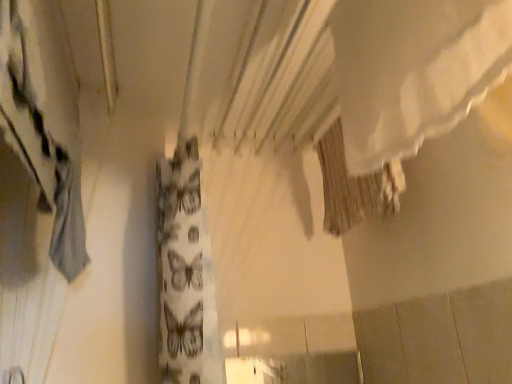
Question: Is gray fabric curtain at left inside the boundaries of brown textured fabric at upper center, or outside?

Choices:
 (A) outside
 (B) inside

Answer: (A)

Question: Visually, is gray fabric curtain at left positioned to the left or to the right of brown textured fabric at upper center?

Choices:
 (A) right
 (B) left

Answer: (B)

Question: From a real-world perspective, is gray fabric curtain at left above or below brown textured fabric at upper center?

Choices:
 (A) above
 (B) below

Answer: (B)

Question: Considering the positions of brown textured fabric at upper center and gray fabric curtain at left in the image, is brown textured fabric at upper center bigger or smaller than gray fabric curtain at left?

Choices:
 (A) small
 (B) big

Answer: (A)

Question: Is brown textured fabric at upper center inside or outside of gray fabric curtain at left?

Choices:
 (A) outside
 (B) inside

Answer: (A)

Question: Visually, is brown textured fabric at upper center positioned to the left or to the right of gray fabric curtain at left?

Choices:
 (A) left
 (B) right

Answer: (B)

Question: From a real-world perspective, is brown textured fabric at upper center positioned above or below gray fabric curtain at left?

Choices:
 (A) below
 (B) above

Answer: (B)